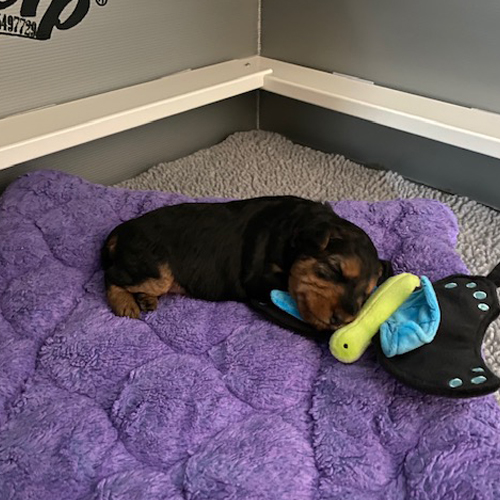
Locate an element on the screen. The width and height of the screenshot is (500, 500). bed in frong of dog is located at coordinates (224, 307).